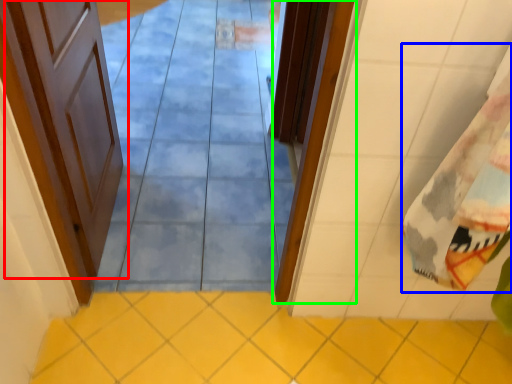
Question: Which is nearer to the door (highlighted by a red box)? beach towel (highlighted by a blue box) or door (highlighted by a green box).

Choices:
 (A) beach towel
 (B) door

Answer: (B)